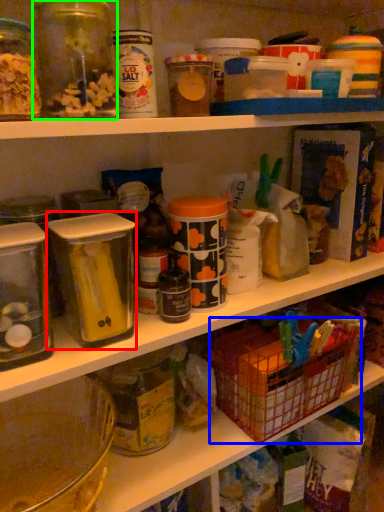
Question: Considering the real-world distances, which object is farthest from carton (highlighted by a red box)? basket (highlighted by a blue box) or glass jar (highlighted by a green box)?

Choices:
 (A) basket
 (B) glass jar

Answer: (A)